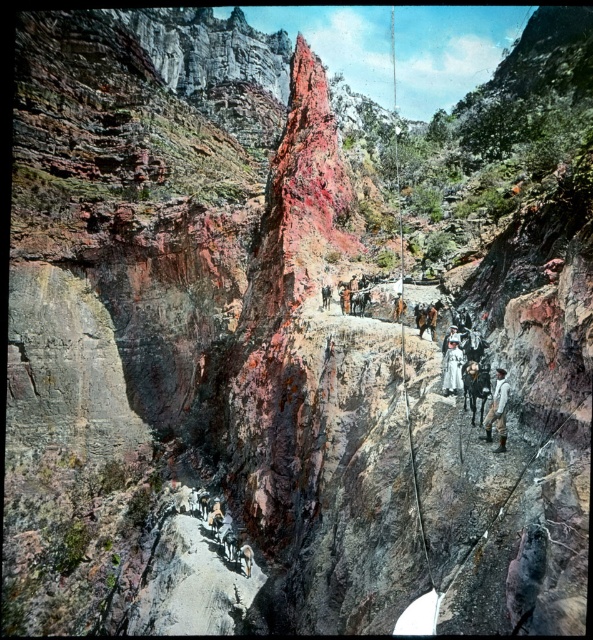
Is light brown leather pants at lower right thinner than white leather boots at lower right?

Incorrect, light brown leather pants at lower right's width is not less than white leather boots at lower right's.

Between light brown leather pants at lower right and white leather boots at lower right, which one has less height?

white leather boots at lower right is shorter.

Does point (486, 420) come closer to viewer compared to point (487, 387)?

Yes, it is in front of point (487, 387).

The height and width of the screenshot is (640, 593). In order to click on light brown leather pants at lower right in this screenshot , I will do `click(498, 410)`.

Where is `white leather boots at lower right`? The image size is (593, 640). white leather boots at lower right is located at coordinates (476, 387).

Does white leather boots at lower right have a greater height compared to white cotton shirt at right?

Yes.

You are a GUI agent. You are given a task and a screenshot of the screen. Output one action in this format:
    pyautogui.click(x=<x>, y=<y>)
    Task: Click on the white leather boots at lower right
    The width and height of the screenshot is (593, 640).
    Given the screenshot: What is the action you would take?
    pyautogui.click(x=476, y=387)

Is light brown leather pants at lower right wider than white cotton shirt at right?

Indeed, light brown leather pants at lower right has a greater width compared to white cotton shirt at right.

Which is in front, point (498, 422) or point (442, 380)?

Point (498, 422) is in front.

The height and width of the screenshot is (640, 593). I want to click on light brown leather pants at lower right, so click(498, 410).